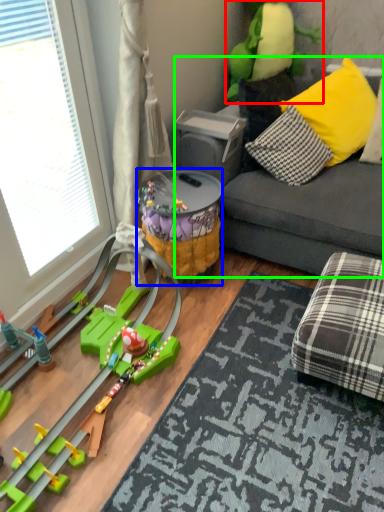
Question: Which object is positioned closest to toy (highlighted by a red box)? Select from toy (highlighted by a blue box) and studio couch (highlighted by a green box).

Choices:
 (A) toy
 (B) studio couch

Answer: (B)